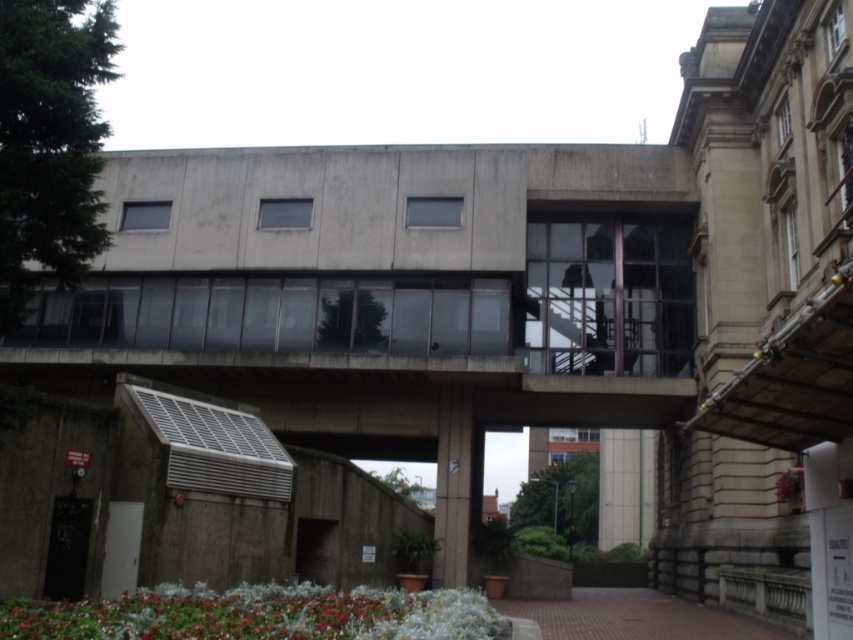
You are standing in front of the building and notice a green leafy plant at lower center and a brown brick path at lower center. Which object is positioned more to the left side?

The green leafy plant at lower center is positioned more to the left side than the brown brick path at lower center.

You are standing at the entrance of the building and want to reach the green leafy plant at lower center. Is the brown brick path at lower center blocking your way to the plant?

The green leafy plant at lower center is in front of the brown brick path at lower center, so the path is behind the plant and not blocking your way.